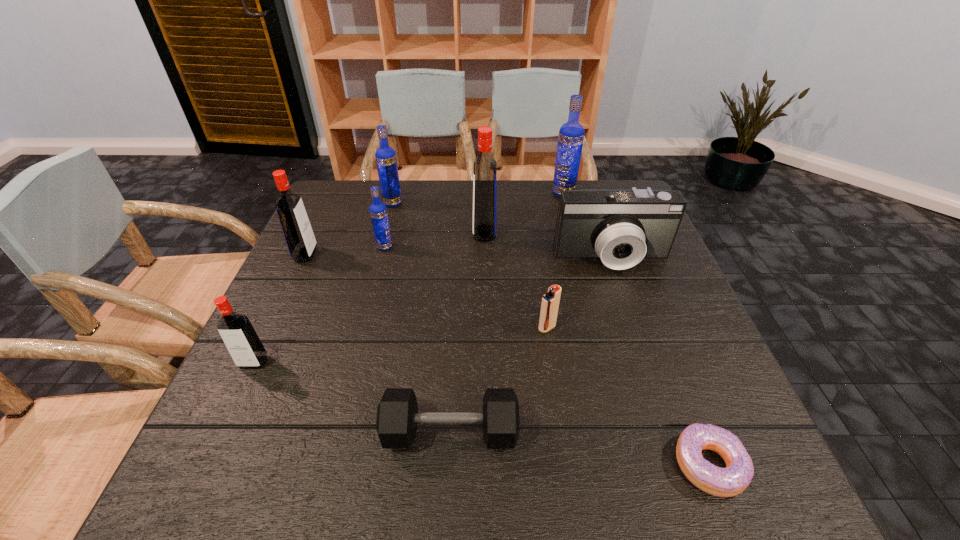
This screenshot has width=960, height=540. Identify the location of the rightmost blue vodka. (571, 134).

Locate an element on the screen. The height and width of the screenshot is (540, 960). the biggest blue vodka is located at coordinates (571, 134).

Find the location of a particular element. the fifth vodka from left to right is located at coordinates (485, 172).

The height and width of the screenshot is (540, 960). Find the location of `the biggest red vodka`. the biggest red vodka is located at coordinates (485, 172).

Image resolution: width=960 pixels, height=540 pixels. Find the location of `the second smallest blue vodka`. the second smallest blue vodka is located at coordinates (386, 161).

Where is `the second biggest red vodka`? The height and width of the screenshot is (540, 960). the second biggest red vodka is located at coordinates (297, 230).

Where is `black camcorder`? This screenshot has height=540, width=960. black camcorder is located at coordinates (621, 227).

You are a GUI agent. You are given a task and a screenshot of the screen. Output one action in this format:
    pyautogui.click(x=<x>, y=<y>)
    Task: Click on the smallest blue vodka
    
    Given the screenshot: What is the action you would take?
    pyautogui.click(x=378, y=211)

Where is `the nearest vodka`? This screenshot has height=540, width=960. the nearest vodka is located at coordinates (246, 349).

At what (x,y) coordinates should I click in order to perform the action: click on the smallest red vodka. Please return your answer as a coordinate pair (x, y). The image size is (960, 540). Looking at the image, I should click on (246, 349).